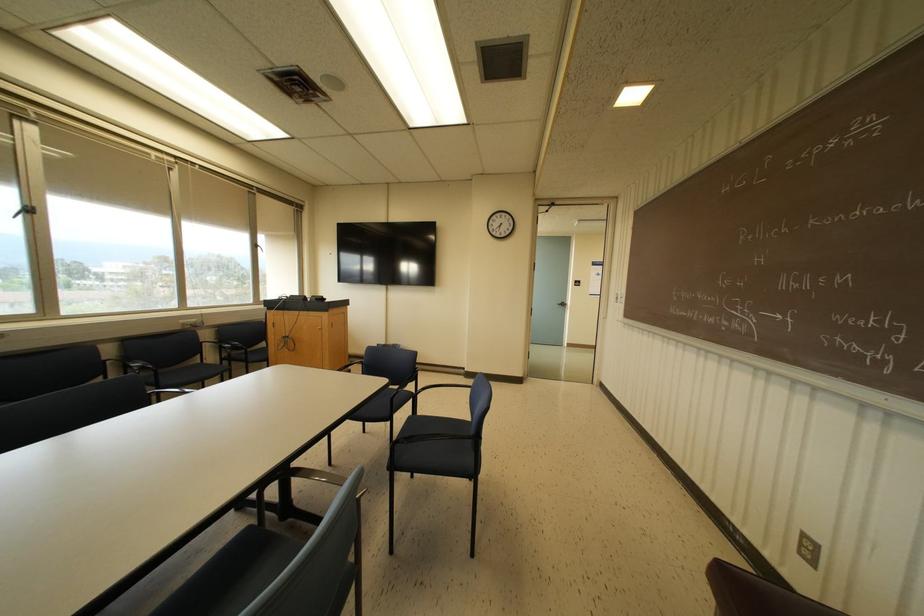
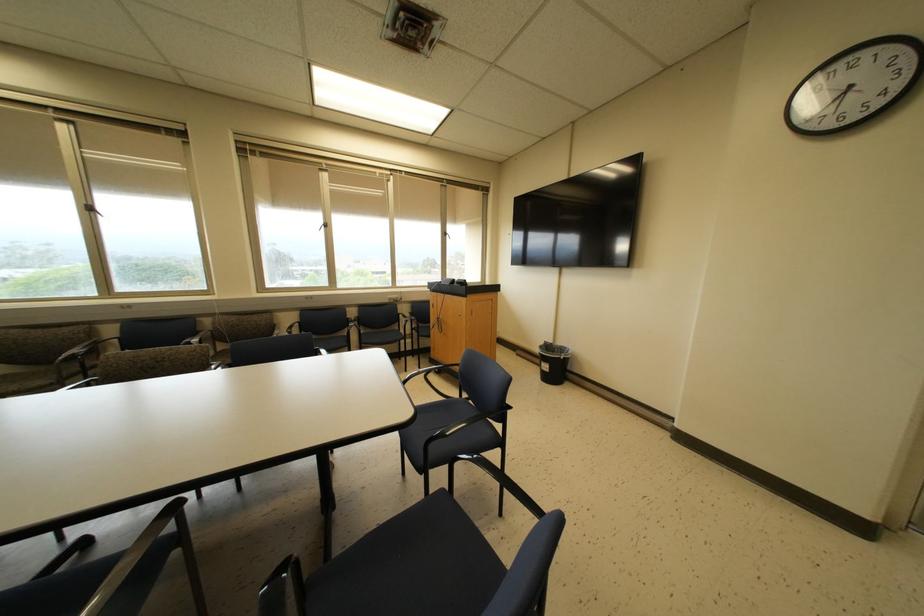
Locate, in the second image, the point that corresponds to point (254, 245) in the first image.

(444, 233)